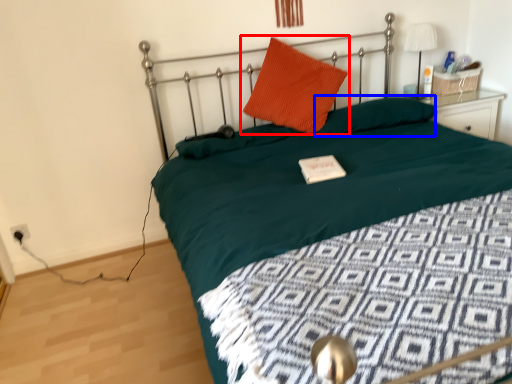
Question: Which of the following is the closest to the observer, pillow (highlighted by a red box) or pillow (highlighted by a blue box)?

Choices:
 (A) pillow
 (B) pillow

Answer: (A)